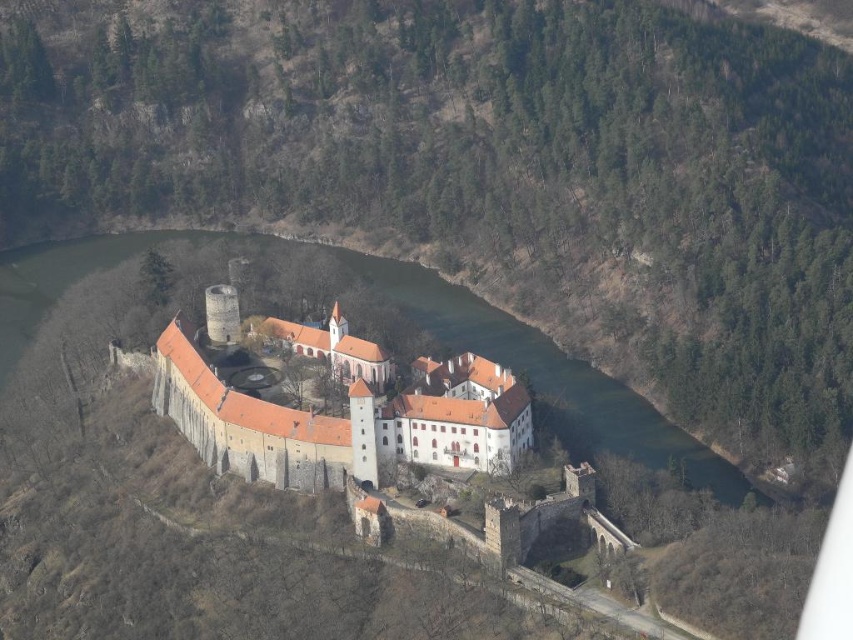
Question: Considering the relative positions of brown stone castle at center and green water at center in the image provided, where is brown stone castle at center located with respect to green water at center?

Choices:
 (A) above
 (B) below

Answer: (B)

Question: Can you confirm if brown stone castle at center is positioned to the right of green water at center?

Choices:
 (A) yes
 (B) no

Answer: (B)

Question: From the image, what is the correct spatial relationship of brown stone castle at center in relation to green water at center?

Choices:
 (A) left
 (B) right

Answer: (A)

Question: Which object is farther from the camera taking this photo?

Choices:
 (A) green water at center
 (B) brown stone castle at center

Answer: (A)

Question: Which point is closer to the camera?

Choices:
 (A) green water at center
 (B) brown stone castle at center

Answer: (B)

Question: Among these objects, which one is farthest from the camera?

Choices:
 (A) brown stone castle at center
 (B) green water at center

Answer: (B)